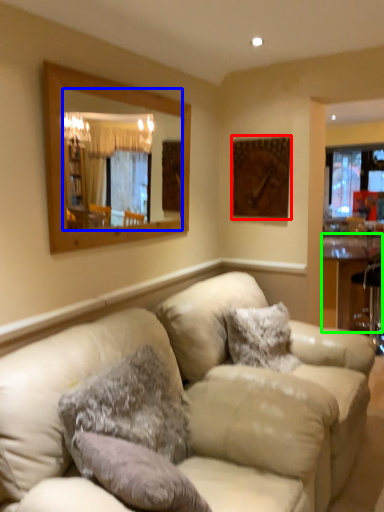
Question: Estimate the real-world distances between objects in this image. Which object is farther from picture frame (highlighted by a red box), mirror (highlighted by a blue box) or table (highlighted by a green box)?

Choices:
 (A) mirror
 (B) table

Answer: (B)